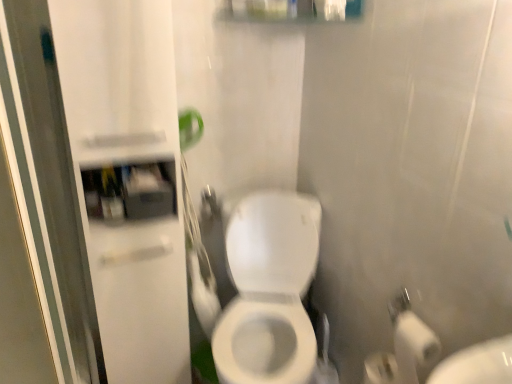
Question: Is white glossy cabinet at left, arranged as the first screen door when viewed from the right, smaller than transparent glass screen door at left, which is counted as the second screen door, starting from the right?

Choices:
 (A) yes
 (B) no

Answer: (B)

Question: Can you confirm if white glossy cabinet at left, the 2th screen door positioned from the left, is wider than transparent glass screen door at left, arranged as the 1th screen door when viewed from the left?

Choices:
 (A) no
 (B) yes

Answer: (A)

Question: Is white glossy cabinet at left, arranged as the first screen door when viewed from the right, positioned in front of transparent glass screen door at left, which is counted as the second screen door, starting from the right?

Choices:
 (A) yes
 (B) no

Answer: (B)

Question: Can you confirm if white glossy cabinet at left, arranged as the first screen door when viewed from the right, is bigger than transparent glass screen door at left, which is counted as the second screen door, starting from the right?

Choices:
 (A) no
 (B) yes

Answer: (B)

Question: Is white glossy cabinet at left, arranged as the first screen door when viewed from the right, at the right side of transparent glass screen door at left, which is counted as the second screen door, starting from the right?

Choices:
 (A) no
 (B) yes

Answer: (B)

Question: Is transparent glass screen door at left, which is counted as the second screen door, starting from the right, located within white glossy cabinet at left, the 2th screen door positioned from the left?

Choices:
 (A) yes
 (B) no

Answer: (B)

Question: Considering the relative sizes of white glossy cabinet at left, arranged as the first screen door when viewed from the right, and matte plastic medicine cabinet at upper left in the image provided, is white glossy cabinet at left, arranged as the first screen door when viewed from the right, shorter than matte plastic medicine cabinet at upper left?

Choices:
 (A) no
 (B) yes

Answer: (A)

Question: Are white glossy cabinet at left, arranged as the first screen door when viewed from the right, and matte plastic medicine cabinet at upper left far apart?

Choices:
 (A) yes
 (B) no

Answer: (B)

Question: Is white glossy cabinet at left, the 2th screen door positioned from the left, at the left side of matte plastic medicine cabinet at upper left?

Choices:
 (A) yes
 (B) no

Answer: (A)

Question: Is white glossy cabinet at left, arranged as the first screen door when viewed from the right, bigger than matte plastic medicine cabinet at upper left?

Choices:
 (A) yes
 (B) no

Answer: (A)

Question: Is white glossy cabinet at left, arranged as the first screen door when viewed from the right, thinner than matte plastic medicine cabinet at upper left?

Choices:
 (A) yes
 (B) no

Answer: (B)

Question: Would you say white glossy cabinet at left, the 2th screen door positioned from the left, contains matte plastic medicine cabinet at upper left?

Choices:
 (A) yes
 (B) no

Answer: (A)

Question: Considering the relative positions of transparent glass screen door at left, which is counted as the second screen door, starting from the right, and white glossy toilet at center in the image provided, is transparent glass screen door at left, which is counted as the second screen door, starting from the right, to the right of white glossy toilet at center from the viewer's perspective?

Choices:
 (A) no
 (B) yes

Answer: (A)